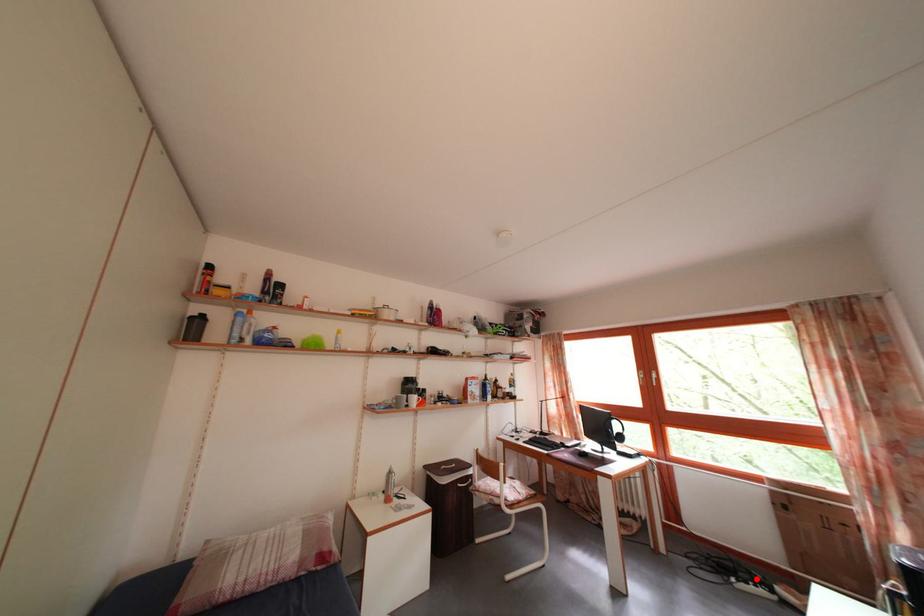
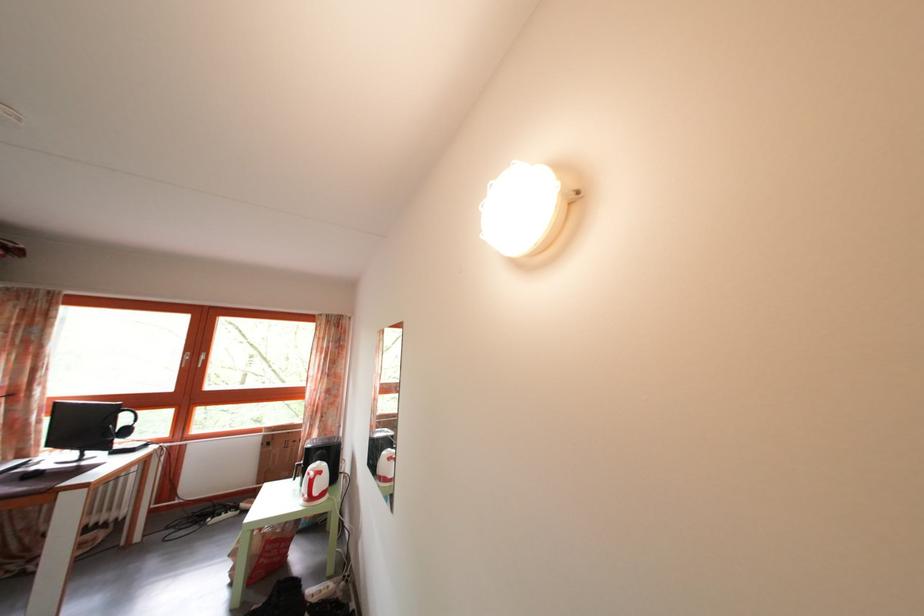
Question: I am providing you with two images of the same scene from different viewpoints. Image1 has a red point marked. In image2, the corresponding 3D location appears at what relative position? Reply with the corresponding letter.

Choices:
 (A) Closer
 (B) Farther

Answer: (A)